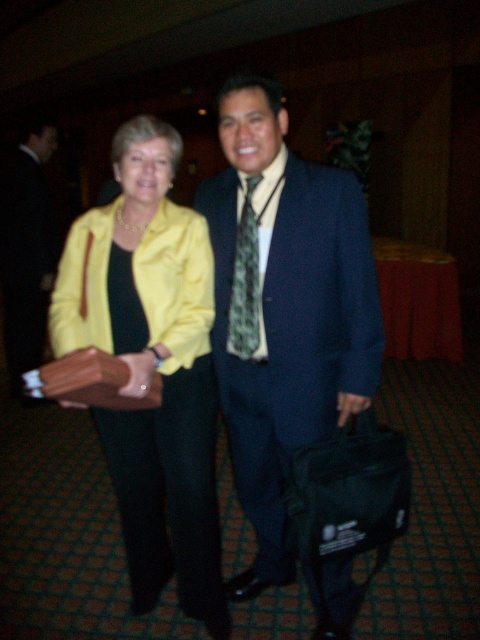
Can you confirm if matte blue suit at center is positioned to the left of matte black suit at center?

Incorrect, matte blue suit at center is not on the left side of matte black suit at center.

Between point (339, 208) and point (22, 221), which one is positioned behind?

The point (22, 221) is behind.

Does point (267, 499) lie in front of point (26, 244)?

Yes, point (267, 499) is closer to viewer.

Locate an element on the screen. matte blue suit at center is located at coordinates (284, 308).

Between satin yellow jacket at center and matte black suit at center, which one is positioned lower?

satin yellow jacket at center is below.

Does satin yellow jacket at center have a greater width compared to matte black suit at center?

Correct, the width of satin yellow jacket at center exceeds that of matte black suit at center.

Locate an element on the screen. satin yellow jacket at center is located at coordinates (152, 365).

Which is in front, point (208, 397) or point (253, 230)?

Point (253, 230) is in front.

Does satin yellow jacket at center appear under green patterned tie at center?

Yes, satin yellow jacket at center is below green patterned tie at center.

The width and height of the screenshot is (480, 640). I want to click on satin yellow jacket at center, so click(x=152, y=365).